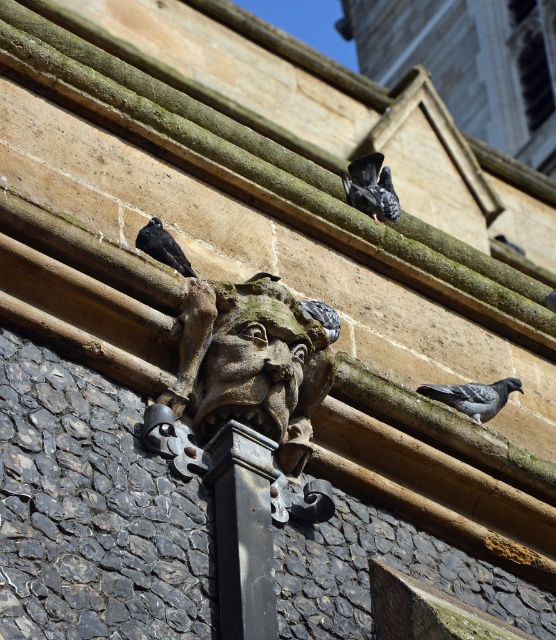
Question: Among these objects, which one is farthest from the camera?

Choices:
 (A) gray matte pigeon at lower right
 (B) carved stone gargoyle at center
 (C) black stone pillar at center

Answer: (A)

Question: Does carved stone gargoyle at center appear on the right side of gray matte pigeon at lower right?

Choices:
 (A) no
 (B) yes

Answer: (A)

Question: Is carved stone gargoyle at center to the left of shiny black bird at upper left from the viewer's perspective?

Choices:
 (A) no
 (B) yes

Answer: (A)

Question: Which object is farther from the camera taking this photo?

Choices:
 (A) carved stone gargoyle at center
 (B) gray matte pigeon at center
 (C) gray matte pigeon at lower right
 (D) shiny black bird at upper left

Answer: (C)

Question: Which point is farther to the camera?

Choices:
 (A) black stone pillar at center
 (B) gray matte pigeon at center
 (C) shiny black bird at upper left
 (D) carved stone gargoyle at center

Answer: (B)

Question: Can you confirm if carved stone gargoyle at center is wider than shiny black bird at upper left?

Choices:
 (A) yes
 (B) no

Answer: (A)